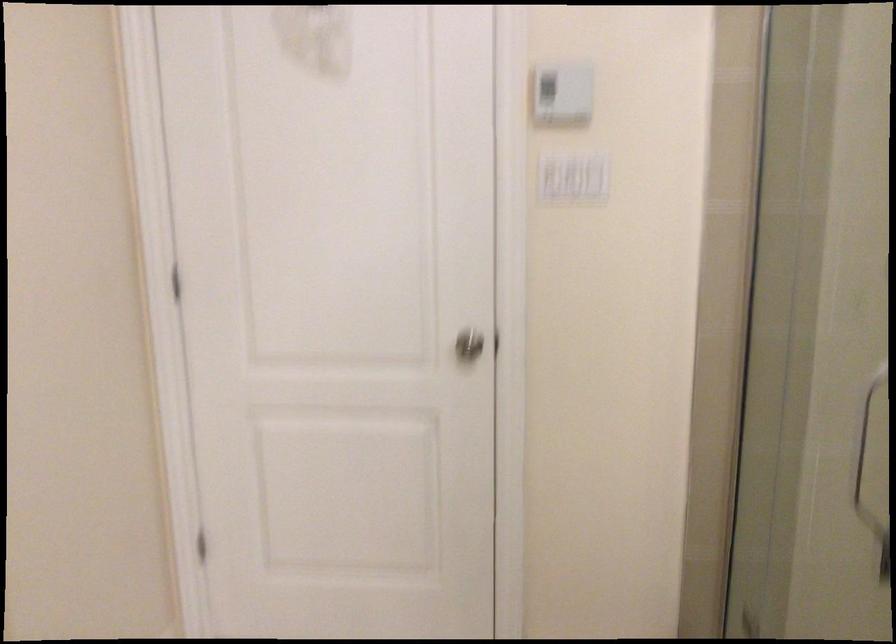
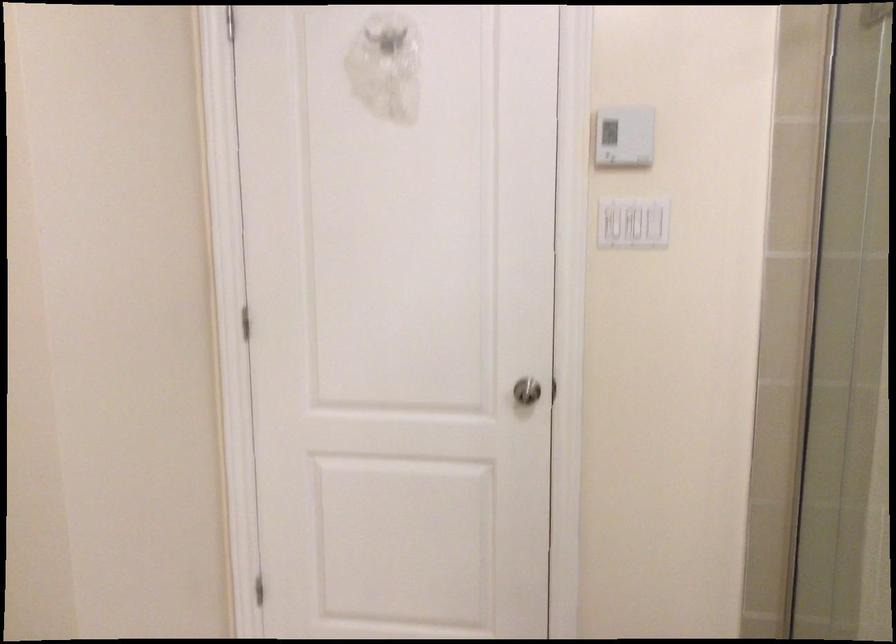
In the second image, find the point that corresponds to (x=597, y=129) in the first image.

(655, 222)